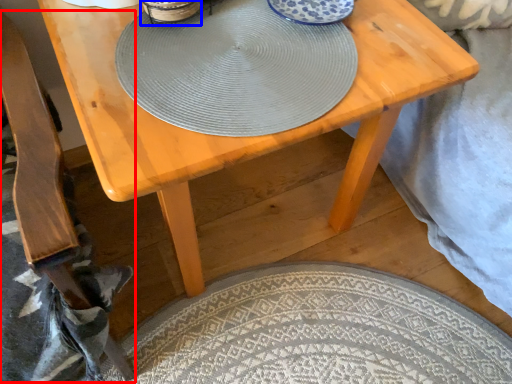
Question: Which object appears closest to the camera in this image, armchair (highlighted by a red box) or tableware (highlighted by a blue box)?

Choices:
 (A) armchair
 (B) tableware

Answer: (A)